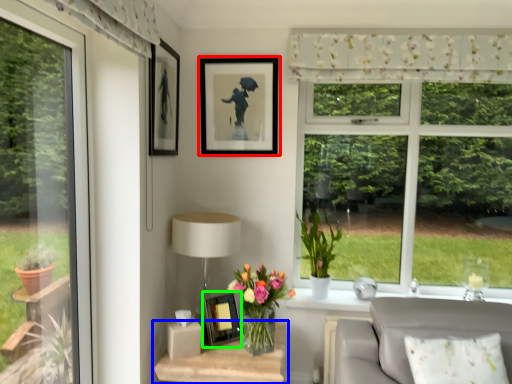
Question: Estimate the real-world distances between objects in this image. Which object is closer to picture frame (highlighted by a red box), table (highlighted by a blue box) or picture frame (highlighted by a green box)?

Choices:
 (A) table
 (B) picture frame

Answer: (B)